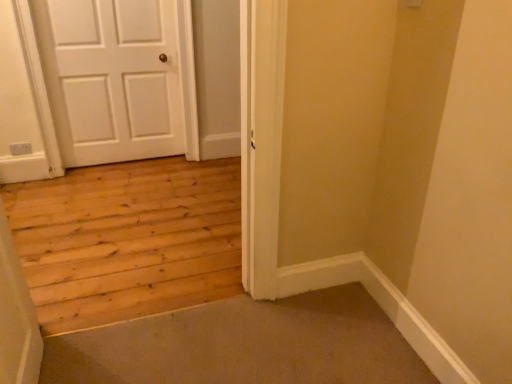
At what (x,y) coordinates should I click in order to perform the action: click on free space above white painted wood door at upper left (from a real-world perspective). Please return your answer as a coordinate pair (x, y). Looking at the image, I should click on (109, 0).